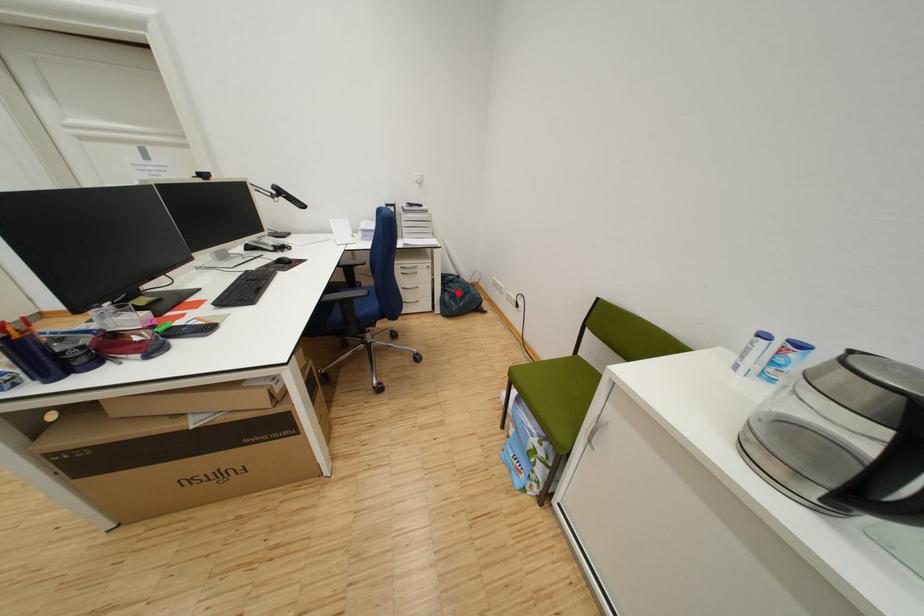
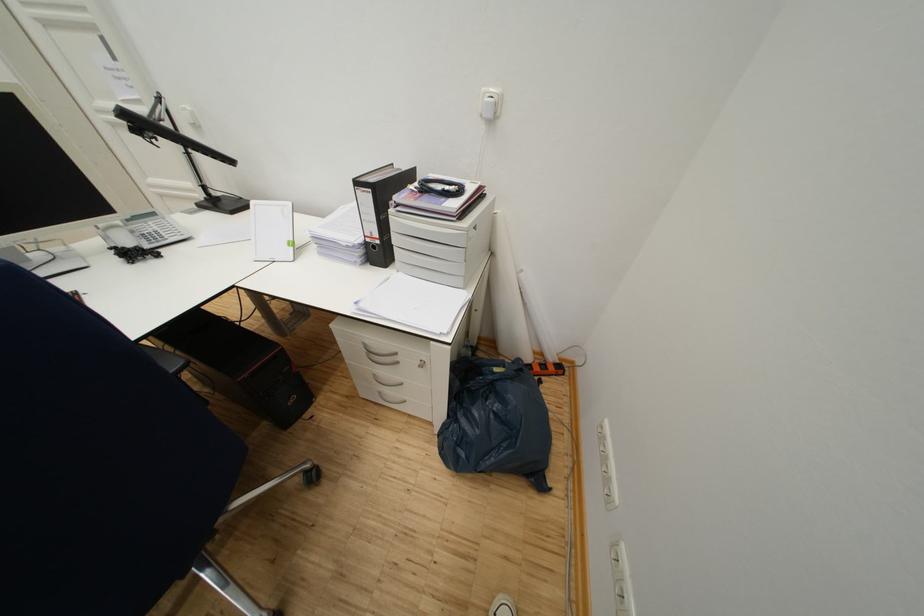
Question: I am providing you with two images of the same scene from different viewpoints. A red point is marked on the first image. Can you still see the location of the red point in image 2?

Choices:
 (A) Yes
 (B) No

Answer: (A)